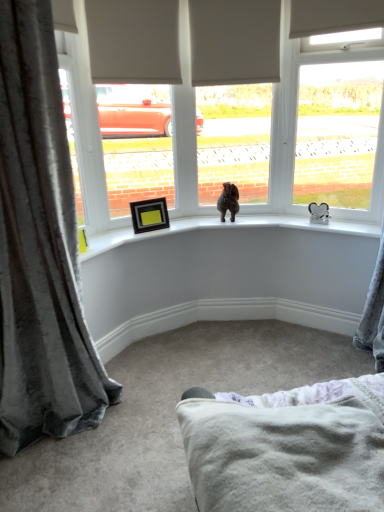
Question: Is white plastic window at upper right wider or thinner than velvet gray curtain at left?

Choices:
 (A) wide
 (B) thin

Answer: (B)

Question: Is white plastic window at upper right taller or shorter than velvet gray curtain at left?

Choices:
 (A) tall
 (B) short

Answer: (B)

Question: Which is farther from the black matte picture frame at upper left?

Choices:
 (A) white plastic window at upper right
 (B) velvet gray curtain at left
 (C) soft white fleece blanket at lower center
 (D) brown plush bear at center

Answer: (C)

Question: Which object is the farthest from the soft white fleece blanket at lower center?

Choices:
 (A) velvet gray curtain at left
 (B) black matte picture frame at upper left
 (C) white plastic window at upper right
 (D) brown plush bear at center

Answer: (C)